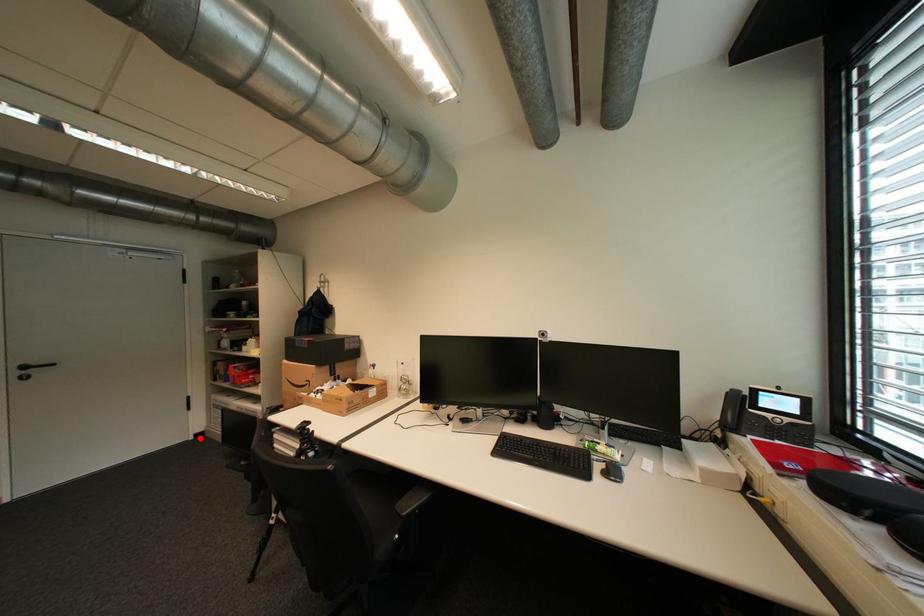
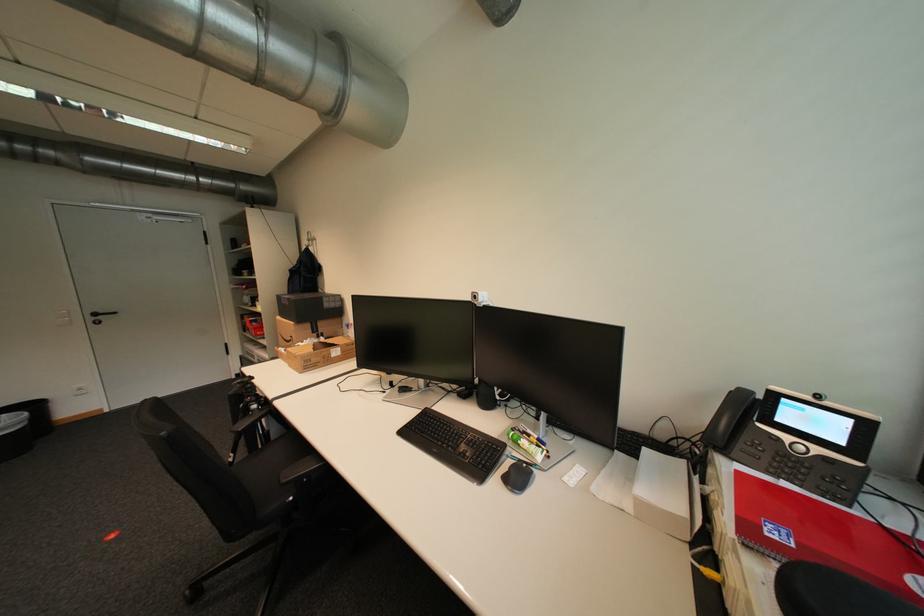
Find the pixel in the second image that matches the highlighted location in the first image.

(242, 378)